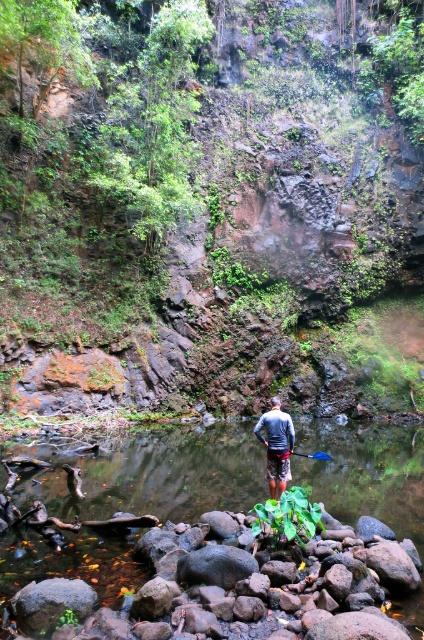
Question: Is the position of smooth rock stream at center less distant than that of gray fabric shirt at center?

Choices:
 (A) yes
 (B) no

Answer: (A)

Question: Among these objects, which one is nearest to the camera?

Choices:
 (A) smooth rock stream at center
 (B) gray fabric shirt at center

Answer: (A)

Question: Which of the following is the closest to the observer?

Choices:
 (A) gray fabric shirt at center
 (B) smooth rock stream at center

Answer: (B)

Question: Can you confirm if smooth rock stream at center is bigger than gray fabric shirt at center?

Choices:
 (A) yes
 (B) no

Answer: (A)

Question: Can you confirm if smooth rock stream at center is positioned above gray fabric shirt at center?

Choices:
 (A) yes
 (B) no

Answer: (B)

Question: Which point is farther from the camera taking this photo?

Choices:
 (A) (287, 417)
 (B) (401, 490)

Answer: (B)